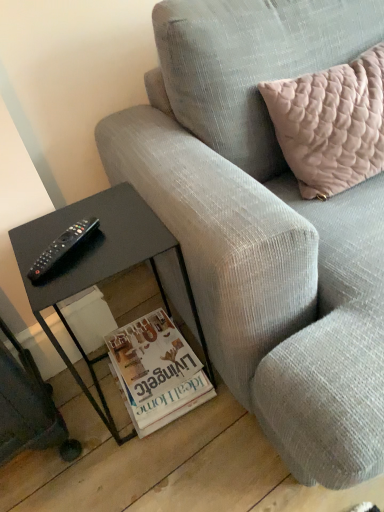
Question: Considering the relative sizes of black glass table at lower left and gray corduroy couch at center in the image provided, is black glass table at lower left taller than gray corduroy couch at center?

Choices:
 (A) yes
 (B) no

Answer: (B)

Question: Considering the relative sizes of black glass table at lower left and gray corduroy couch at center in the image provided, is black glass table at lower left shorter than gray corduroy couch at center?

Choices:
 (A) yes
 (B) no

Answer: (A)

Question: From a real-world perspective, is black glass table at lower left below gray corduroy couch at center?

Choices:
 (A) yes
 (B) no

Answer: (A)

Question: Is gray corduroy couch at center at the back of black glass table at lower left?

Choices:
 (A) no
 (B) yes

Answer: (A)

Question: Is gray corduroy couch at center a part of black glass table at lower left?

Choices:
 (A) yes
 (B) no

Answer: (B)

Question: Are black glass table at lower left and gray corduroy couch at center far apart?

Choices:
 (A) yes
 (B) no

Answer: (B)

Question: Is black glass table at lower left not close to black plastic remote at left?

Choices:
 (A) no
 (B) yes

Answer: (A)

Question: Is black glass table at lower left placed right next to black plastic remote at left?

Choices:
 (A) no
 (B) yes

Answer: (A)

Question: Is black glass table at lower left outside black plastic remote at left?

Choices:
 (A) no
 (B) yes

Answer: (B)

Question: Is black plastic remote at left at the back of black glass table at lower left?

Choices:
 (A) yes
 (B) no

Answer: (B)

Question: Does black glass table at lower left appear on the right side of black plastic remote at left?

Choices:
 (A) no
 (B) yes

Answer: (B)

Question: From the image's perspective, is black glass table at lower left below black plastic remote at left?

Choices:
 (A) no
 (B) yes

Answer: (B)

Question: Is gray corduroy couch at center taller than pale pink quilted cushion at upper right?

Choices:
 (A) no
 (B) yes

Answer: (B)